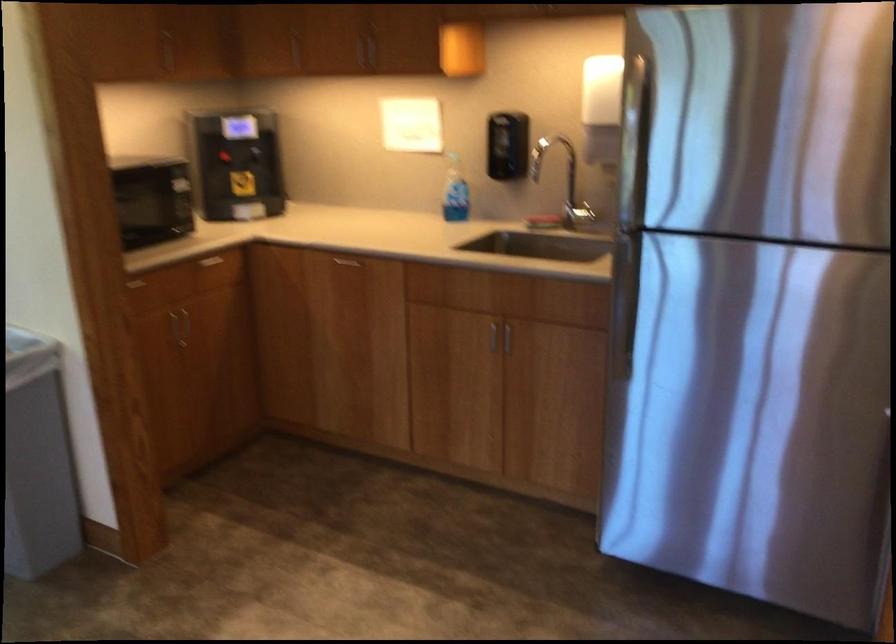
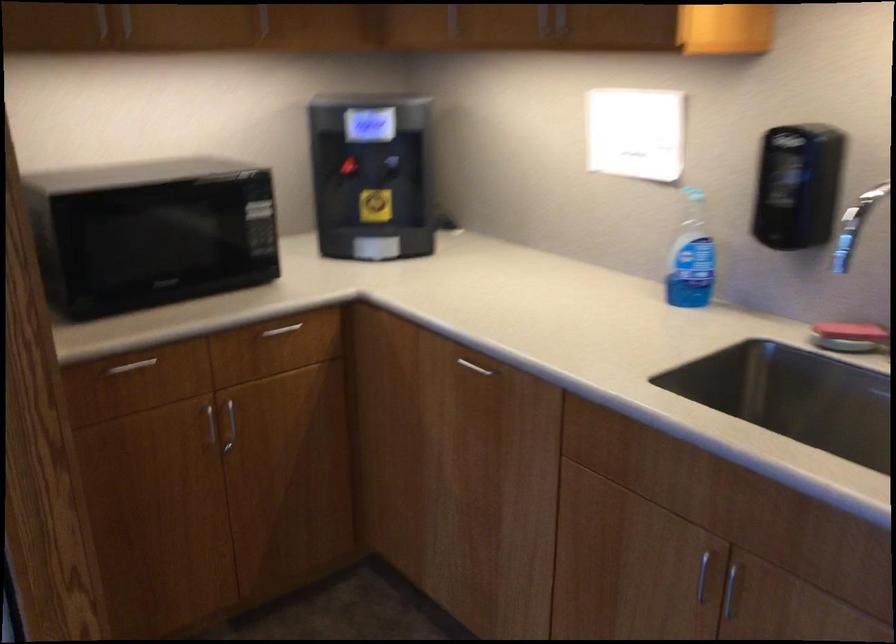
Locate, in the second image, the point that corresponds to point 178,327 in the first image.

(229, 426)